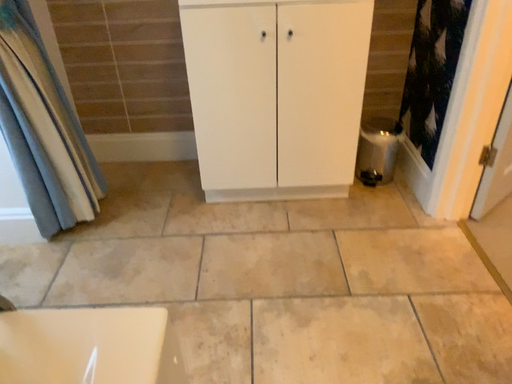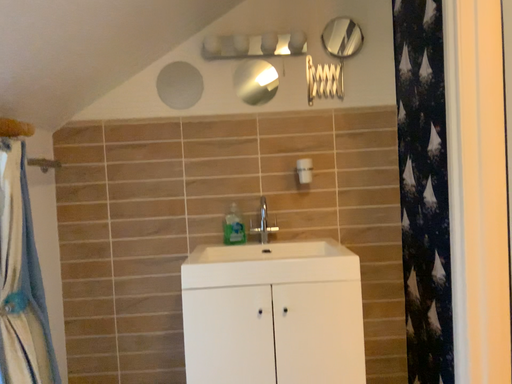
Question: How did the camera likely rotate when shooting the video?

Choices:
 (A) rotated downward
 (B) rotated upward

Answer: (B)